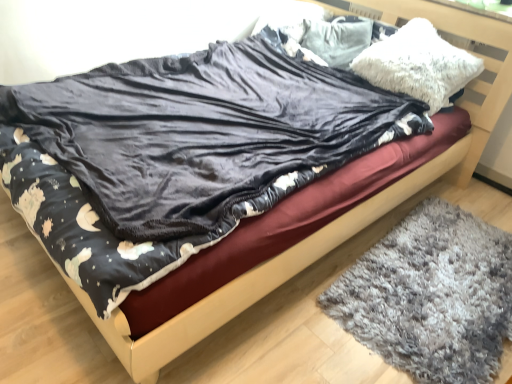
Locate an element on the screen. Image resolution: width=512 pixels, height=384 pixels. velvet dark blue blanket at center is located at coordinates (202, 131).

Image resolution: width=512 pixels, height=384 pixels. What are the coordinates of `gray shaggy rug at lower right` in the screenshot? It's located at (431, 296).

Where is `white fluffy pillow at upper right, the 2th pillow positioned from the back`? The height and width of the screenshot is (384, 512). white fluffy pillow at upper right, the 2th pillow positioned from the back is located at coordinates (418, 64).

The image size is (512, 384). Find the location of `white fluffy pillow at upper center, the 2th pillow positioned from the front`. white fluffy pillow at upper center, the 2th pillow positioned from the front is located at coordinates (337, 39).

Locate an element on the screen. The height and width of the screenshot is (384, 512). wooden bed frame at center is located at coordinates (288, 223).

Would you say gray shaggy rug at lower right is a long distance from white fluffy pillow at upper center, the 2th pillow positioned from the front?

gray shaggy rug at lower right is far away from white fluffy pillow at upper center, the 2th pillow positioned from the front.

Which object is further away from the camera taking this photo, gray shaggy rug at lower right or white fluffy pillow at upper center, the 1th pillow in the back-to-front sequence?

white fluffy pillow at upper center, the 1th pillow in the back-to-front sequence, is further from the camera.

Considering the positions of objects gray shaggy rug at lower right and white fluffy pillow at upper center, the 2th pillow positioned from the front, in the image provided, who is more to the left, gray shaggy rug at lower right or white fluffy pillow at upper center, the 2th pillow positioned from the front,?

white fluffy pillow at upper center, the 2th pillow positioned from the front, is more to the left.

From the image's perspective, is gray shaggy rug at lower right under white fluffy pillow at upper center, the 1th pillow in the back-to-front sequence?

Yes, from the image's perspective, gray shaggy rug at lower right is below white fluffy pillow at upper center, the 1th pillow in the back-to-front sequence.

Is point (476, 72) positioned behind point (366, 42)?

No, (476, 72) is in front of (366, 42).

From the image's perspective, is white fluffy pillow at upper right, the first pillow in the front-to-back sequence, on white fluffy pillow at upper center, the 1th pillow in the back-to-front sequence?

No, from the image's perspective, white fluffy pillow at upper right, the first pillow in the front-to-back sequence, is not over white fluffy pillow at upper center, the 1th pillow in the back-to-front sequence.

From a real-world perspective, who is located higher, white fluffy pillow at upper right, the first pillow in the front-to-back sequence, or white fluffy pillow at upper center, the 2th pillow positioned from the front?

white fluffy pillow at upper center, the 2th pillow positioned from the front, is physically above.

Is there a large distance between white fluffy pillow at upper right, the first pillow in the front-to-back sequence, and white fluffy pillow at upper center, the 2th pillow positioned from the front?

They are positioned close to each other.

Based on the photo, in terms of height, does velvet dark blue blanket at center look taller or shorter compared to white fluffy pillow at upper center, the 1th pillow in the back-to-front sequence?

Considering their sizes, velvet dark blue blanket at center has less height than white fluffy pillow at upper center, the 1th pillow in the back-to-front sequence.

What's the angular difference between velvet dark blue blanket at center and white fluffy pillow at upper center, the 1th pillow in the back-to-front sequence,'s facing directions?

The angular difference between velvet dark blue blanket at center and white fluffy pillow at upper center, the 1th pillow in the back-to-front sequence, is 0.82 degrees.

Does velvet dark blue blanket at center have a smaller size compared to white fluffy pillow at upper center, the 2th pillow positioned from the front?

Incorrect, velvet dark blue blanket at center is not smaller in size than white fluffy pillow at upper center, the 2th pillow positioned from the front.

Is velvet dark blue blanket at center thinner than white fluffy pillow at upper center, the 1th pillow in the back-to-front sequence?

No.

Between wooden bed frame at center and white fluffy pillow at upper center, the 2th pillow positioned from the front, which one has larger width?

With larger width is wooden bed frame at center.

Are wooden bed frame at center and white fluffy pillow at upper center, the 2th pillow positioned from the front, located far from each other?

wooden bed frame at center is actually quite close to white fluffy pillow at upper center, the 2th pillow positioned from the front.

Is wooden bed frame at center positioned with its back to white fluffy pillow at upper center, the 2th pillow positioned from the front?

No, wooden bed frame at center is not facing the opposite direction of white fluffy pillow at upper center, the 2th pillow positioned from the front.

From the picture: Is white fluffy pillow at upper right, the 2th pillow positioned from the back, completely or partially outside of velvet dark blue blanket at center?

Indeed, white fluffy pillow at upper right, the 2th pillow positioned from the back, is completely outside velvet dark blue blanket at center.

How many degrees apart are the facing directions of white fluffy pillow at upper right, the first pillow in the front-to-back sequence, and velvet dark blue blanket at center?

They differ by 12.5 degrees in their facing directions.

How far apart are white fluffy pillow at upper right, the first pillow in the front-to-back sequence, and velvet dark blue blanket at center?

The distance of white fluffy pillow at upper right, the first pillow in the front-to-back sequence, from velvet dark blue blanket at center is 23.48 inches.

Considering the relative sizes of white fluffy pillow at upper right, the 2th pillow positioned from the back, and velvet dark blue blanket at center in the image provided, is white fluffy pillow at upper right, the 2th pillow positioned from the back, bigger than velvet dark blue blanket at center?

No, white fluffy pillow at upper right, the 2th pillow positioned from the back, is not bigger than velvet dark blue blanket at center.

How different are the orientations of gray shaggy rug at lower right and white fluffy pillow at upper right, the 2th pillow positioned from the back, in degrees?

The angular difference between gray shaggy rug at lower right and white fluffy pillow at upper right, the 2th pillow positioned from the back, is 15.7 degrees.

From the image's perspective, is gray shaggy rug at lower right below white fluffy pillow at upper right, the first pillow in the front-to-back sequence?

Indeed, from the image's perspective, gray shaggy rug at lower right is shown beneath white fluffy pillow at upper right, the first pillow in the front-to-back sequence.

Looking at this image, is gray shaggy rug at lower right looking in the opposite direction of white fluffy pillow at upper right, the first pillow in the front-to-back sequence?

gray shaggy rug at lower right is not turned away from white fluffy pillow at upper right, the first pillow in the front-to-back sequence.

Looking at this image, which is more to the right, white fluffy pillow at upper center, the 2th pillow positioned from the front, or white fluffy pillow at upper right, the 2th pillow positioned from the back?

white fluffy pillow at upper right, the 2th pillow positioned from the back, is more to the right.

Is point (361, 45) farther from camera compared to point (436, 47)?

Yes, point (361, 45) is behind point (436, 47).

In the scene shown: Is white fluffy pillow at upper center, the 1th pillow in the back-to-front sequence, aimed at white fluffy pillow at upper right, the 2th pillow positioned from the back?

No, white fluffy pillow at upper center, the 1th pillow in the back-to-front sequence, does not turn towards white fluffy pillow at upper right, the 2th pillow positioned from the back.

Which of these two, white fluffy pillow at upper center, the 2th pillow positioned from the front, or white fluffy pillow at upper right, the first pillow in the front-to-back sequence, is bigger?

white fluffy pillow at upper right, the first pillow in the front-to-back sequence.

The width and height of the screenshot is (512, 384). Identify the location of pillow on the left of gray shaggy rug at lower right. (337, 39).

Find the location of a particular element. The height and width of the screenshot is (384, 512). pillow above the white fluffy pillow at upper right, the 2th pillow positioned from the back (from a real-world perspective) is located at coordinates (337, 39).

Estimate the real-world distances between objects in this image. Which object is further from white fluffy pillow at upper right, the 2th pillow positioned from the back, gray shaggy rug at lower right or white fluffy pillow at upper center, the 2th pillow positioned from the front?

The object further to white fluffy pillow at upper right, the 2th pillow positioned from the back, is gray shaggy rug at lower right.

Estimate the real-world distances between objects in this image. Which object is closer to white fluffy pillow at upper center, the 1th pillow in the back-to-front sequence, wooden bed frame at center or white fluffy pillow at upper right, the first pillow in the front-to-back sequence?

Based on the image, white fluffy pillow at upper right, the first pillow in the front-to-back sequence, appears to be nearer to white fluffy pillow at upper center, the 1th pillow in the back-to-front sequence.

Considering their positions, is velvet dark blue blanket at center positioned closer to white fluffy pillow at upper center, the 1th pillow in the back-to-front sequence, than white fluffy pillow at upper right, the first pillow in the front-to-back sequence?

white fluffy pillow at upper right, the first pillow in the front-to-back sequence, lies closer to white fluffy pillow at upper center, the 1th pillow in the back-to-front sequence, than the other object.

From the image, which object appears to be farther from velvet dark blue blanket at center, wooden bed frame at center or gray shaggy rug at lower right?

Based on the image, gray shaggy rug at lower right appears to be further to velvet dark blue blanket at center.

Which object lies nearer to the anchor point white fluffy pillow at upper right, the first pillow in the front-to-back sequence, wooden bed frame at center or white fluffy pillow at upper center, the 1th pillow in the back-to-front sequence?

white fluffy pillow at upper center, the 1th pillow in the back-to-front sequence.

Which object lies nearer to the anchor point velvet dark blue blanket at center, wooden bed frame at center or white fluffy pillow at upper right, the 2th pillow positioned from the back?

Based on the image, wooden bed frame at center appears to be nearer to velvet dark blue blanket at center.

When comparing their distances from velvet dark blue blanket at center, does wooden bed frame at center or white fluffy pillow at upper center, the 2th pillow positioned from the front, seem closer?

Among the two, wooden bed frame at center is located nearer to velvet dark blue blanket at center.

Based on their spatial positions, is velvet dark blue blanket at center or white fluffy pillow at upper center, the 2th pillow positioned from the front, further from wooden bed frame at center?

white fluffy pillow at upper center, the 2th pillow positioned from the front.

The image size is (512, 384). I want to click on blanket located between wooden bed frame at center and white fluffy pillow at upper center, the 2th pillow positioned from the front, in the depth direction, so click(202, 131).

Find the location of a particular element. The height and width of the screenshot is (384, 512). mat located between wooden bed frame at center and white fluffy pillow at upper center, the 2th pillow positioned from the front, in the depth direction is located at coordinates (431, 296).

The width and height of the screenshot is (512, 384). In order to click on bed frame between white fluffy pillow at upper right, the first pillow in the front-to-back sequence, and gray shaggy rug at lower right, in the vertical direction in this screenshot , I will do [x=288, y=223].

Locate an element on the screen. pillow between wooden bed frame at center and white fluffy pillow at upper center, the 2th pillow positioned from the front, in the front-back direction is located at coordinates (418, 64).